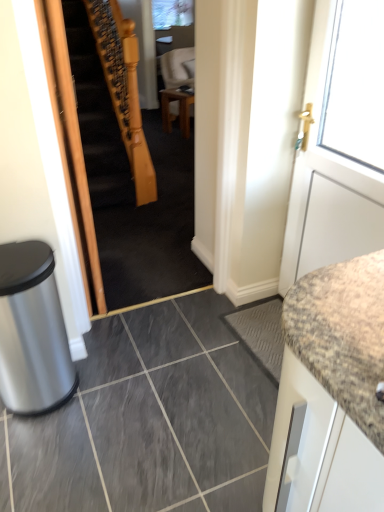
Question: Is wooden staircase at center in front of or behind white matte door at right in the image?

Choices:
 (A) behind
 (B) front

Answer: (A)

Question: Considering the positions of wooden staircase at center and white matte door at right in the image, is wooden staircase at center bigger or smaller than white matte door at right?

Choices:
 (A) big
 (B) small

Answer: (A)

Question: Based on their relative distances, which object is nearer to the wooden staircase at center?

Choices:
 (A) gray matte tile at center
 (B) silver metallic trash bin at lower left
 (C) white matte door at right
 (D) wooden table at center

Answer: (A)

Question: Estimate the real-world distances between objects in this image. Which object is farther from the silver metallic trash bin at lower left?

Choices:
 (A) wooden staircase at center
 (B) wooden table at center
 (C) gray matte tile at center
 (D) white matte door at right

Answer: (B)